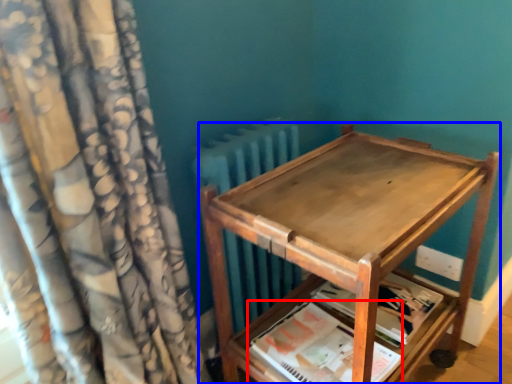
Question: Which object appears farthest to the camera in this image, paperback book (highlighted by a red box) or furniture (highlighted by a blue box)?

Choices:
 (A) paperback book
 (B) furniture

Answer: (A)